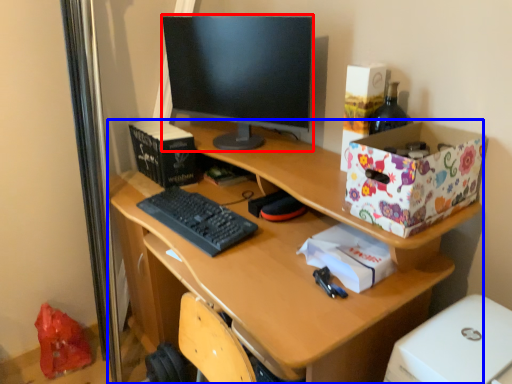
Question: Among these objects, which one is farthest to the camera, television (highlighted by a red box) or desk (highlighted by a blue box)?

Choices:
 (A) television
 (B) desk

Answer: (A)